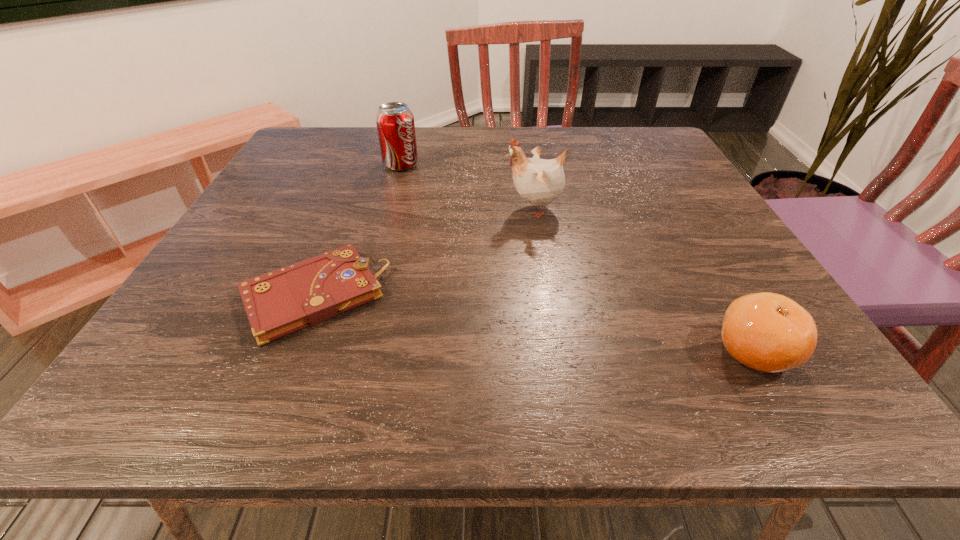
Locate an element on the screen. vacant space located on the back of the second shortest object is located at coordinates (665, 200).

At what (x,y) coordinates should I click in order to perform the action: click on vacant area situated 0.180m on the right of the notebook. Please return your answer as a coordinate pair (x, y). The width and height of the screenshot is (960, 540). Looking at the image, I should click on (492, 295).

Locate an element on the screen. Image resolution: width=960 pixels, height=540 pixels. object situated at the far edge is located at coordinates (395, 124).

Where is `object at the near edge`? object at the near edge is located at coordinates (768, 332).

Identify the location of object that is at the left edge. (277, 303).

Find the location of a particular element. This screenshot has height=540, width=960. object present at the right edge is located at coordinates (768, 332).

I want to click on object located at the near right corner, so click(768, 332).

In the image, there is a desktop. Where is `free space at the far edge`? The height and width of the screenshot is (540, 960). free space at the far edge is located at coordinates (532, 129).

In the image, there is a desktop. At what (x,y) coordinates should I click in order to perform the action: click on free space at the near edge. Please return your answer as a coordinate pair (x, y). Looking at the image, I should click on (679, 398).

The width and height of the screenshot is (960, 540). I want to click on vacant space at the left edge of the desktop, so click(x=283, y=215).